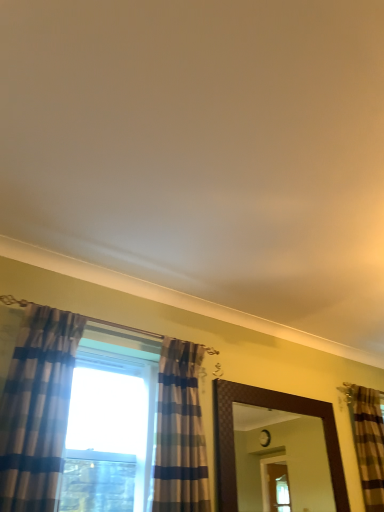
What do you see at coordinates (369, 445) in the screenshot? I see `brown striped curtain at right, the 1th curtain in the back-to-front sequence` at bounding box center [369, 445].

Find the location of `brown striped curtain at right, which appears as the third curtain when viewed from the front`. brown striped curtain at right, which appears as the third curtain when viewed from the front is located at coordinates (369, 445).

Is plaid fabric curtain at left, placed as the third curtain when sorted from right to left, taller or shorter than brown textured mirror at center?

In the image, plaid fabric curtain at left, placed as the third curtain when sorted from right to left, appears to be taller than brown textured mirror at center.

Choose the correct answer: Is plaid fabric curtain at left, marked as the 3th curtain in a back-to-front arrangement, inside brown textured mirror at center or outside it?

plaid fabric curtain at left, marked as the 3th curtain in a back-to-front arrangement, exists outside the volume of brown textured mirror at center.

Looking at this image, which object is thinner, plaid fabric curtain at left, marked as the 3th curtain in a back-to-front arrangement, or brown textured mirror at center?

brown textured mirror at center is thinner.

Is plaid fabric curtain at left, placed as the third curtain when sorted from right to left, next to brown textured mirror at center?

They are not placed beside each other.

Which of these two, brown textured mirror at center or brown striped curtain at right, positioned as the 3th curtain in left-to-right order, is thinner?

brown textured mirror at center is thinner.

From a real-world perspective, who is located higher, brown textured mirror at center or brown striped curtain at right, which appears as the third curtain when viewed from the front?

brown striped curtain at right, which appears as the third curtain when viewed from the front, is physically above.

Between brown textured mirror at center and brown striped curtain at right, which appears as the third curtain when viewed from the front, which one has smaller size?

brown striped curtain at right, which appears as the third curtain when viewed from the front.

In the image, is brown striped curtain at right, the 1th curtain in the back-to-front sequence, on the left side or the right side of striped fabric curtain at center, which appears as the 2th curtain when viewed from the back?

brown striped curtain at right, the 1th curtain in the back-to-front sequence, is to the right of striped fabric curtain at center, which appears as the 2th curtain when viewed from the back.

From the image's perspective, starting from the brown striped curtain at right, the 1th curtain in the back-to-front sequence, which curtain is the 1st one above? Please provide its 2D coordinates.

[(180, 432)]

Does brown striped curtain at right, the 1th curtain in the back-to-front sequence, have a greater height compared to striped fabric curtain at center, the 2th curtain viewed from the right?

Answer: Indeed, brown striped curtain at right, the 1th curtain in the back-to-front sequence, has a greater height compared to striped fabric curtain at center, the 2th curtain viewed from the right.

Is brown striped curtain at right, positioned as the 3th curtain in left-to-right order, not near striped fabric curtain at center, which is the 2th curtain from left to right?

Yes.

Looking at this image, are striped fabric curtain at center, the 2th curtain viewed from the right, and plaid fabric curtain at left, placed as the first curtain when sorted from front to back, located far from each other?

striped fabric curtain at center, the 2th curtain viewed from the right, is actually quite close to plaid fabric curtain at left, placed as the first curtain when sorted from front to back.

From a real-world perspective, count 2nd curtains downward from the plaid fabric curtain at left, placed as the first curtain when sorted from left to right, and point to it. Please provide its 2D coordinates.

[(180, 432)]

From the image's perspective, is striped fabric curtain at center, placed as the 2th curtain when sorted from front to back, positioned above or below plaid fabric curtain at left, marked as the 3th curtain in a back-to-front arrangement?

striped fabric curtain at center, placed as the 2th curtain when sorted from front to back, is below plaid fabric curtain at left, marked as the 3th curtain in a back-to-front arrangement.

Between striped fabric curtain at center, the 2th curtain viewed from the right, and brown striped curtain at right, which appears as the third curtain when viewed from the front, which one appears on the right side from the viewer's perspective?

brown striped curtain at right, which appears as the third curtain when viewed from the front.

Does striped fabric curtain at center, placed as the 2th curtain when sorted from front to back, have a lesser width compared to brown striped curtain at right, positioned as the 3th curtain in left-to-right order?

Incorrect, the width of striped fabric curtain at center, placed as the 2th curtain when sorted from front to back, is not less than that of brown striped curtain at right, positioned as the 3th curtain in left-to-right order.

Can you tell me how much striped fabric curtain at center, which is the 2th curtain from left to right, and brown striped curtain at right, the 1th curtain in the back-to-front sequence, differ in facing direction?

1.32 degrees.

How distant is plaid fabric curtain at left, placed as the first curtain when sorted from front to back, from brown striped curtain at right, which appears as the third curtain when viewed from the front?

The distance of plaid fabric curtain at left, placed as the first curtain when sorted from front to back, from brown striped curtain at right, which appears as the third curtain when viewed from the front, is 8.63 feet.

Is plaid fabric curtain at left, placed as the first curtain when sorted from front to back, taller than brown striped curtain at right, the 1th curtain when ordered from right to left?

Yes.

Does plaid fabric curtain at left, placed as the first curtain when sorted from front to back, come in front of brown striped curtain at right, the 1th curtain when ordered from right to left?

Yes, it is.

From the image's perspective, is plaid fabric curtain at left, placed as the third curtain when sorted from right to left, above or below brown striped curtain at right, which appears as the third curtain when viewed from the front?

Based on their image positions, plaid fabric curtain at left, placed as the third curtain when sorted from right to left, is located above brown striped curtain at right, which appears as the third curtain when viewed from the front.

Is plaid fabric curtain at left, placed as the first curtain when sorted from front to back, in contact with striped fabric curtain at center, which appears as the 2th curtain when viewed from the back?

There is a gap between plaid fabric curtain at left, placed as the first curtain when sorted from front to back, and striped fabric curtain at center, which appears as the 2th curtain when viewed from the back.

The height and width of the screenshot is (512, 384). Find the location of `the 1st curtain below the plaid fabric curtain at left, placed as the first curtain when sorted from front to back (from the image's perspective)`. the 1st curtain below the plaid fabric curtain at left, placed as the first curtain when sorted from front to back (from the image's perspective) is located at coordinates (180, 432).

In terms of width, does plaid fabric curtain at left, placed as the first curtain when sorted from left to right, look wider or thinner when compared to striped fabric curtain at center, the 2th curtain viewed from the right?

In the image, plaid fabric curtain at left, placed as the first curtain when sorted from left to right, appears to be wider than striped fabric curtain at center, the 2th curtain viewed from the right.

Where is `mirror located behind the plaid fabric curtain at left, placed as the first curtain when sorted from left to right`? Image resolution: width=384 pixels, height=512 pixels. mirror located behind the plaid fabric curtain at left, placed as the first curtain when sorted from left to right is located at coordinates (281, 461).

From a real-world perspective, count 2nd curtains upward from the brown textured mirror at center and point to it. Please provide its 2D coordinates.

[(369, 445)]

From the picture: Based on their spatial positions, is plaid fabric curtain at left, placed as the first curtain when sorted from left to right, or brown textured mirror at center closer to striped fabric curtain at center, placed as the 2th curtain when sorted from front to back?

plaid fabric curtain at left, placed as the first curtain when sorted from left to right.

Looking at the image, which one is located closer to plaid fabric curtain at left, placed as the first curtain when sorted from left to right, brown textured mirror at center or brown striped curtain at right, the 1th curtain in the back-to-front sequence?

brown striped curtain at right, the 1th curtain in the back-to-front sequence, lies closer to plaid fabric curtain at left, placed as the first curtain when sorted from left to right, than the other object.

Looking at the image, which one is located closer to striped fabric curtain at center, placed as the 2th curtain when sorted from front to back, brown striped curtain at right, the 1th curtain in the back-to-front sequence, or plaid fabric curtain at left, placed as the first curtain when sorted from front to back?

plaid fabric curtain at left, placed as the first curtain when sorted from front to back, is positioned closer to the anchor striped fabric curtain at center, placed as the 2th curtain when sorted from front to back.

From the image, which object appears to be nearer to plaid fabric curtain at left, placed as the first curtain when sorted from left to right, striped fabric curtain at center, which is the 2th curtain from left to right, or brown textured mirror at center?

The object closer to plaid fabric curtain at left, placed as the first curtain when sorted from left to right, is striped fabric curtain at center, which is the 2th curtain from left to right.

Which object lies further to the anchor point brown striped curtain at right, positioned as the 3th curtain in left-to-right order, brown textured mirror at center or plaid fabric curtain at left, marked as the 3th curtain in a back-to-front arrangement?

plaid fabric curtain at left, marked as the 3th curtain in a back-to-front arrangement, is positioned further to the anchor brown striped curtain at right, positioned as the 3th curtain in left-to-right order.

Looking at this image, when comparing their distances from plaid fabric curtain at left, placed as the first curtain when sorted from front to back, does striped fabric curtain at center, which appears as the 2th curtain when viewed from the back, or brown striped curtain at right, the 1th curtain when ordered from right to left, seem closer?

The object closer to plaid fabric curtain at left, placed as the first curtain when sorted from front to back, is striped fabric curtain at center, which appears as the 2th curtain when viewed from the back.

Considering their positions, is brown textured mirror at center positioned closer to striped fabric curtain at center, which is the 2th curtain from left to right, than brown striped curtain at right, the 1th curtain when ordered from right to left?

brown striped curtain at right, the 1th curtain when ordered from right to left, is positioned closer to the anchor striped fabric curtain at center, which is the 2th curtain from left to right.

Based on their spatial positions, is striped fabric curtain at center, which appears as the 2th curtain when viewed from the back, or brown textured mirror at center further from brown striped curtain at right, which appears as the third curtain when viewed from the front?

brown textured mirror at center.

You are a GUI agent. You are given a task and a screenshot of the screen. Output one action in this format:
    pyautogui.click(x=<x>, y=<y>)
    Task: Click on the curtain located between plaid fabric curtain at left, placed as the first curtain when sorted from front to back, and brown textured mirror at center in the left-right direction
    This screenshot has height=512, width=384.
    Given the screenshot: What is the action you would take?
    pyautogui.click(x=180, y=432)

At what (x,y) coordinates should I click in order to perform the action: click on curtain located between plaid fabric curtain at left, placed as the first curtain when sorted from front to back, and brown striped curtain at right, the 1th curtain when ordered from right to left, in the left-right direction. Please return your answer as a coordinate pair (x, y). Looking at the image, I should click on (180, 432).

Where is `mirror between plaid fabric curtain at left, marked as the 3th curtain in a back-to-front arrangement, and brown striped curtain at right, which appears as the third curtain when viewed from the front, in the horizontal direction`? This screenshot has width=384, height=512. mirror between plaid fabric curtain at left, marked as the 3th curtain in a back-to-front arrangement, and brown striped curtain at right, which appears as the third curtain when viewed from the front, in the horizontal direction is located at coordinates (281, 461).

The width and height of the screenshot is (384, 512). What are the coordinates of `mirror between striped fabric curtain at center, which appears as the 2th curtain when viewed from the back, and brown striped curtain at right, the 1th curtain in the back-to-front sequence, from left to right` in the screenshot? It's located at (281, 461).